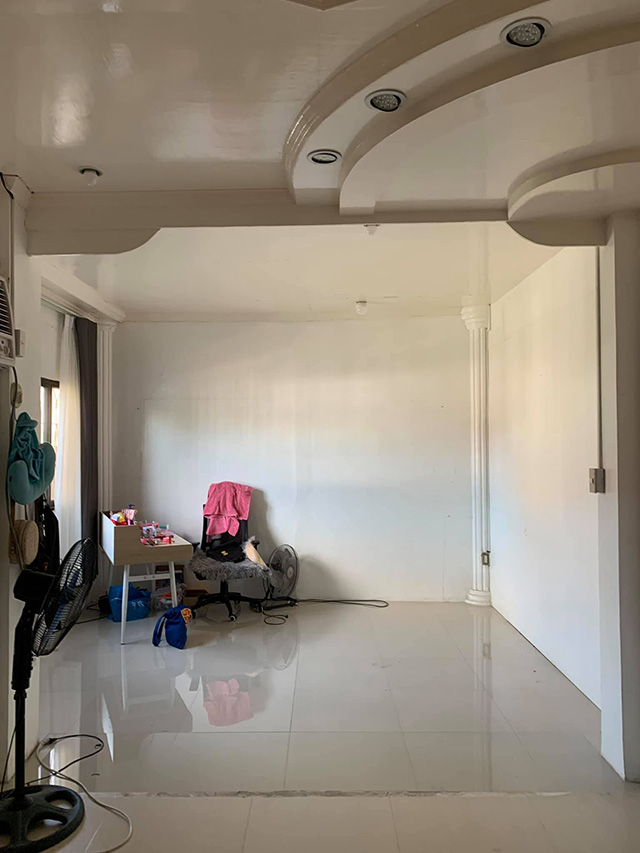
Where is `pillars on the wall`? pillars on the wall is located at coordinates (105, 380), (477, 380).